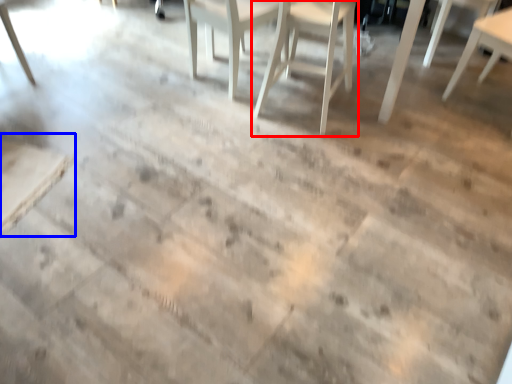
Question: Which object is further to the camera taking this photo, chair (highlighted by a red box) or table (highlighted by a blue box)?

Choices:
 (A) chair
 (B) table

Answer: (A)